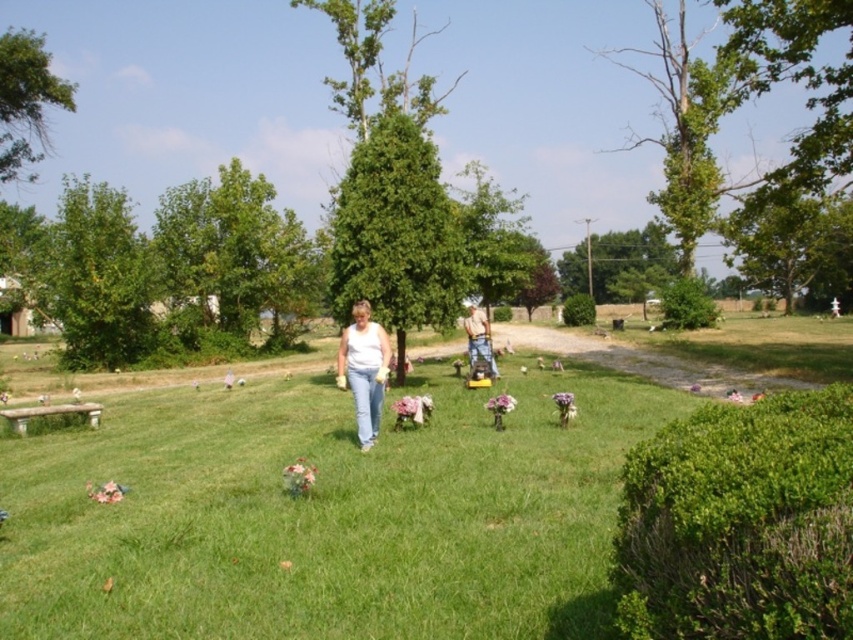
Based on the photo, can you confirm if green grass lawn at center is wider than white cotton shirt at center?

Yes.

Between point (511, 605) and point (351, 365), which one is positioned in front?

Positioned in front is point (511, 605).

Who is more forward, (166, 564) or (357, 342)?

Point (166, 564) is more forward.

At what (x,y) coordinates should I click in order to perform the action: click on green grass lawn at center. Please return your answer as a coordinate pair (x, y). Image resolution: width=853 pixels, height=640 pixels. Looking at the image, I should click on (325, 513).

Is green grass lawn at center taller than denim jeans at center?

No, green grass lawn at center is not taller than denim jeans at center.

Locate an element on the screen. green grass lawn at center is located at coordinates (325, 513).

Is white cotton shirt at center thinner than denim jeans at center?

Yes, white cotton shirt at center is thinner than denim jeans at center.

Measure the distance between white cotton shirt at center and denim jeans at center.

They are 6.52 meters apart.

This screenshot has height=640, width=853. I want to click on white cotton shirt at center, so click(364, 369).